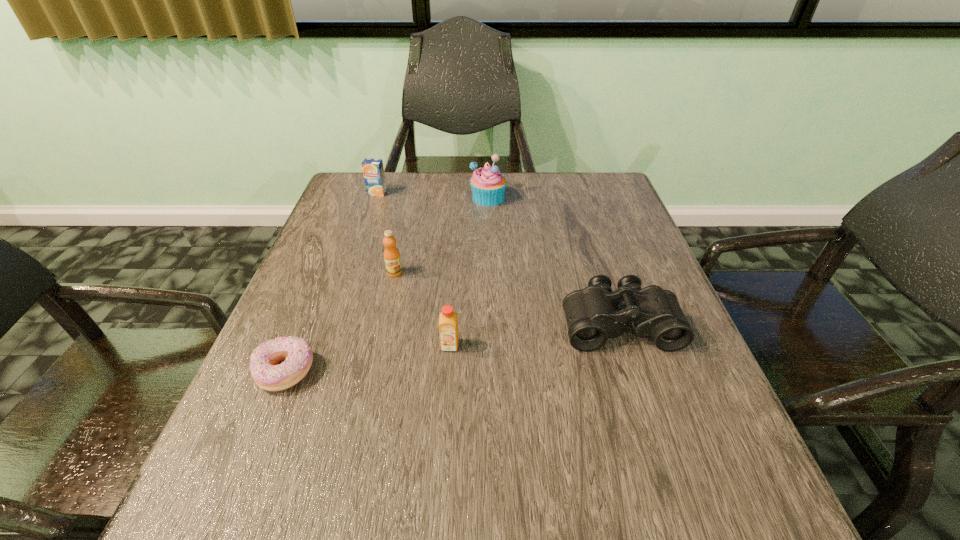
The width and height of the screenshot is (960, 540). In order to click on free spot that satisfies the following two spatial constraints: 1. on the back side of the leftmost orange juice; 2. on the left side of the doughnut in this screenshot , I will do `click(358, 193)`.